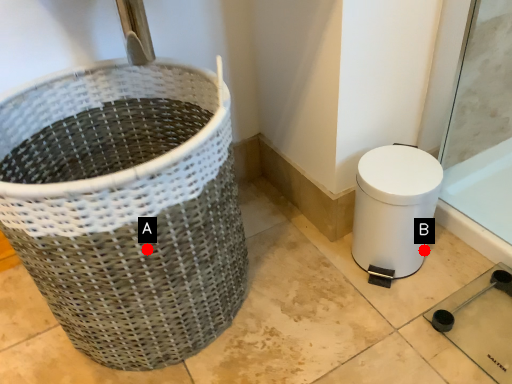
Question: Two points are circled on the image, labeled by A and B beside each circle. Which point is closer to the camera?

Choices:
 (A) A is closer
 (B) B is closer

Answer: (A)